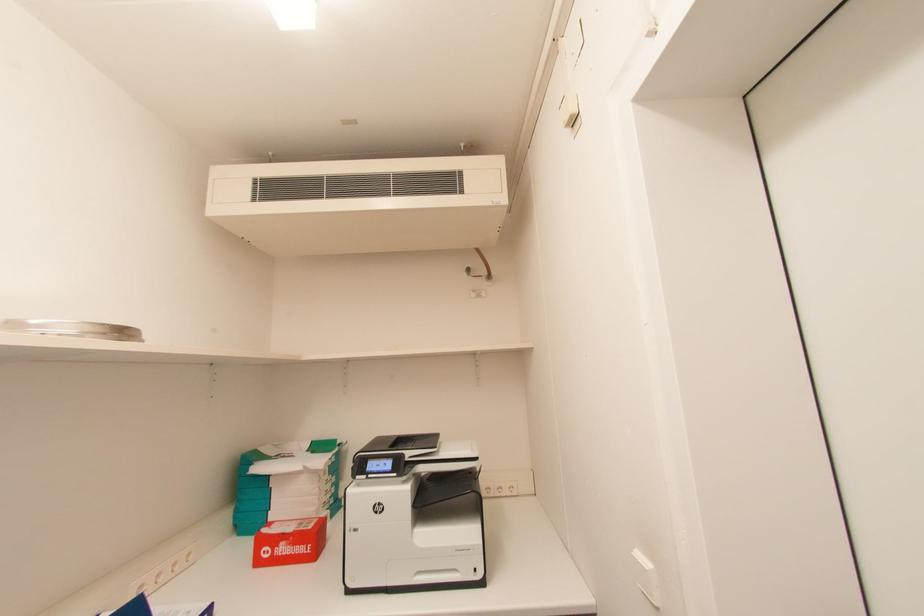
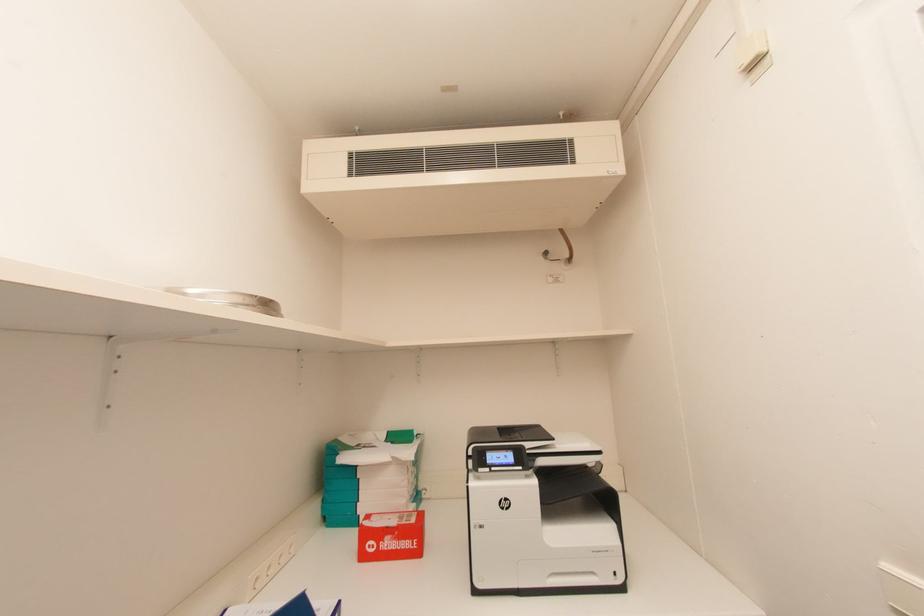
Question: How did the camera likely rotate?

Choices:
 (A) Left
 (B) Right
 (C) Up
 (D) Down

Answer: (A)